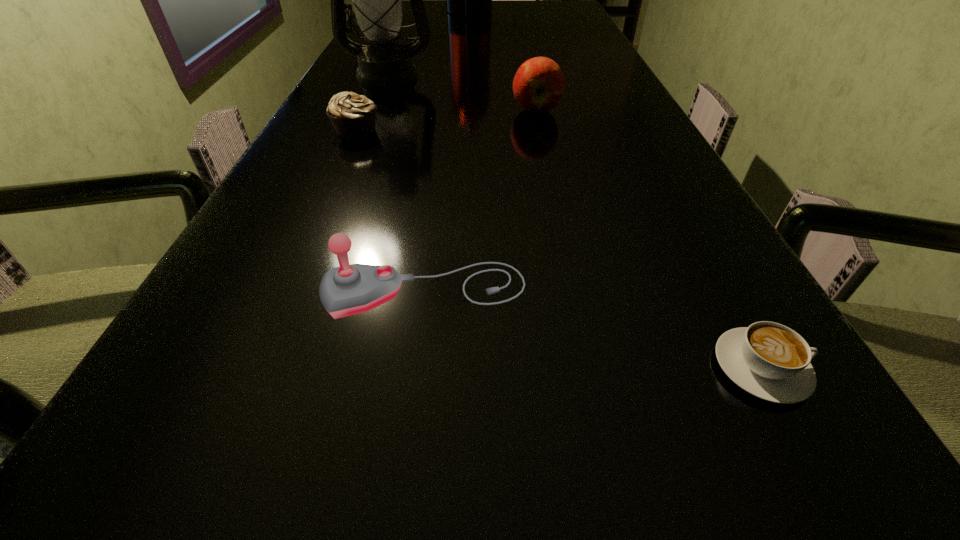
Identify the location of empty space that is in between the nearest object and the oil lamp. (574, 221).

Identify which object is located as the nearest to the tallest object. Please provide its 2D coordinates. Your answer should be formatted as a tuple, i.e. [(x, y)], where the tuple contains the x and y coordinates of a point satisfying the conditions above.

[(377, 3)]

What are the coordinates of `object that stands as the third closest to the fifth nearest object` in the screenshot? It's located at (463, 0).

Identify the location of free spot that satisfies the following two spatial constraints: 1. on the front side of the fifth shortest object; 2. on the right side of the joystick. The image size is (960, 540). (299, 291).